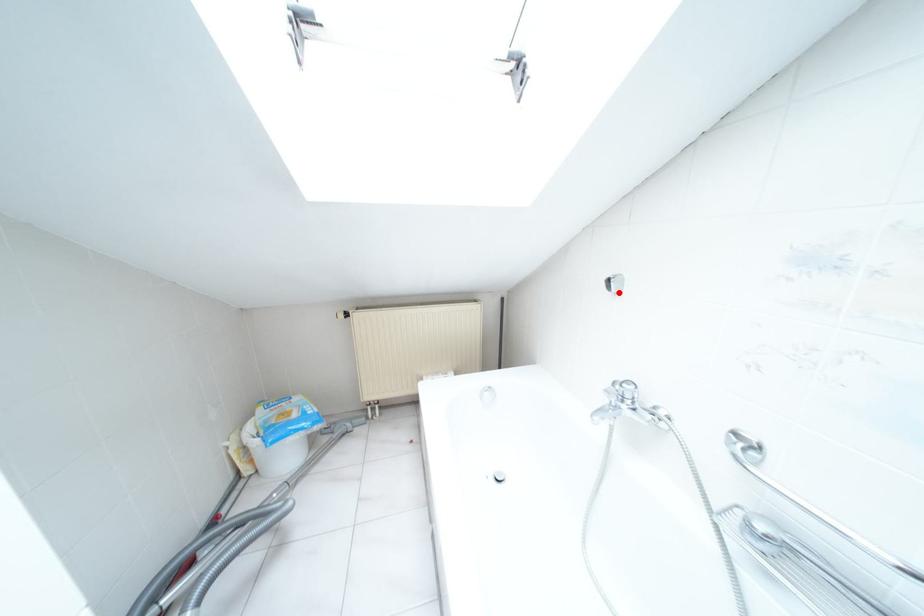
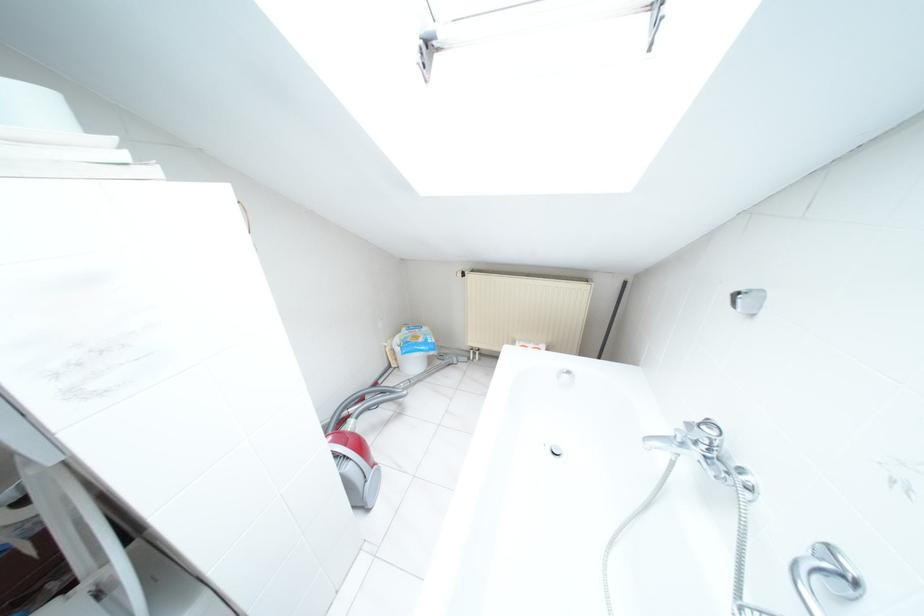
Locate, in the second image, the point that corresponds to the highlighted location in the first image.

(752, 315)